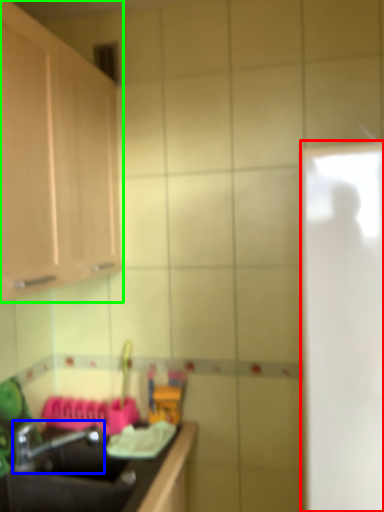
Question: Which object is positioned farthest from glass door (highlighted by a red box)? Select from tap (highlighted by a blue box) and cabinetry (highlighted by a green box).

Choices:
 (A) tap
 (B) cabinetry

Answer: (A)